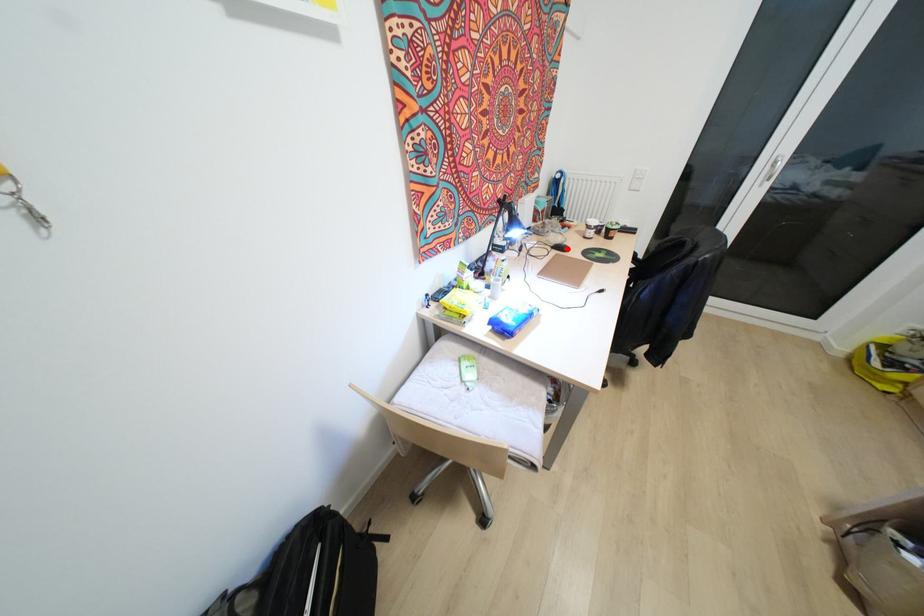
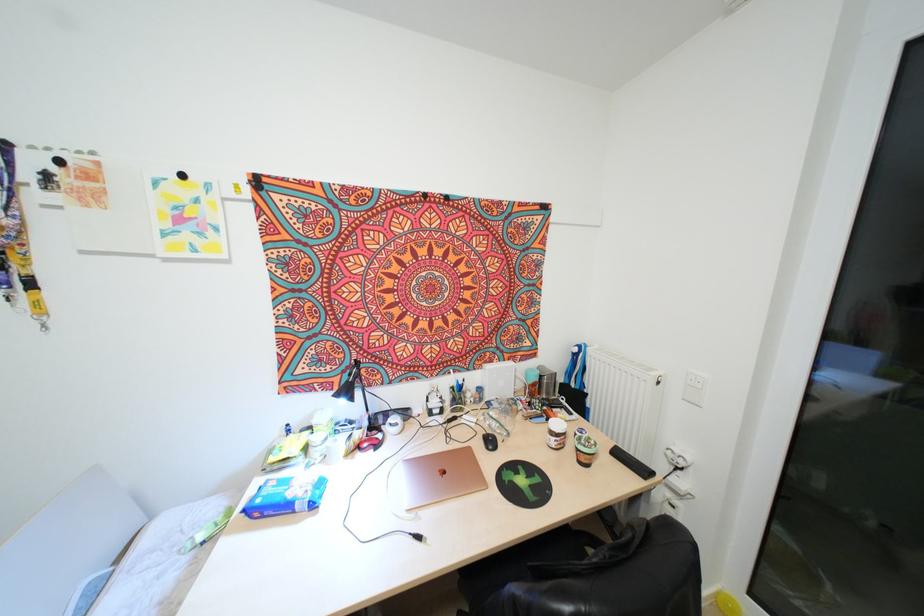
Question: I am providing you with two images of the same scene from different viewpoints. In image1, a red point is highlighted. Considering the same 3D point in image2, which of the following is correct?

Choices:
 (A) It is closer
 (B) It is farther

Answer: (B)